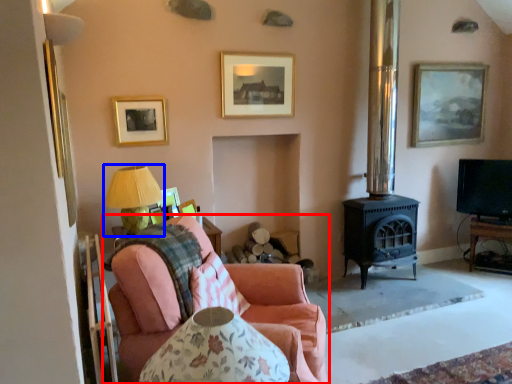
Question: Which object is closer to the camera taking this photo, studio couch (highlighted by a red box) or table lamp (highlighted by a blue box)?

Choices:
 (A) studio couch
 (B) table lamp

Answer: (A)